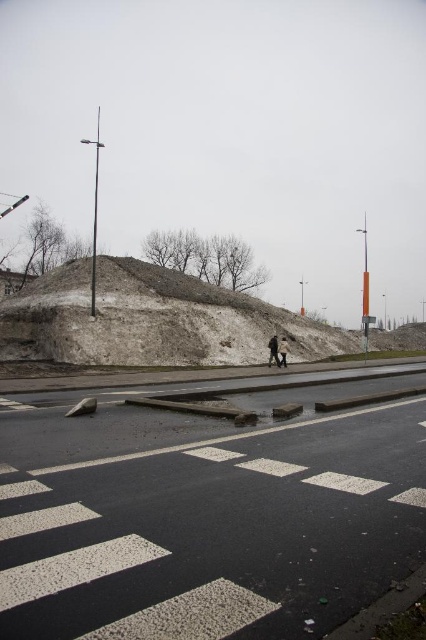
You are a delivery person trying to navigate through the crosswalk area. You have to move from the sidewalk to the road. The gray textured dirt at center and the dark gray fabric coat at center are in your path. Which object is closer to your starting position on the sidewalk?

The dark gray fabric coat at center is closer to your starting position on the sidewalk because it is to the left of the gray textured dirt at center.

You are standing at the pedestrian crossing on the wet road and see two points marked on the ground. The first point is at coordinates point (155, 310) and the second is at point (276, 346). From your perspective facing the direction of the street, which point is closer to you?

Point (155, 310) is behind point (276, 346), so the point closer to you is point (276, 346).

You are a city planner assessing the safety of this pedestrian area. Given the distance between the gray textured dirt at center and the light brown leather jacket at center, do you think the current spacing between the construction material and the pedestrians is sufficient to prevent accidents?

The distance between the gray textured dirt at center and the light brown leather jacket at center is 17.33 meters, which is sufficient to prevent accidents as it provides a safe buffer between the construction material and pedestrians.